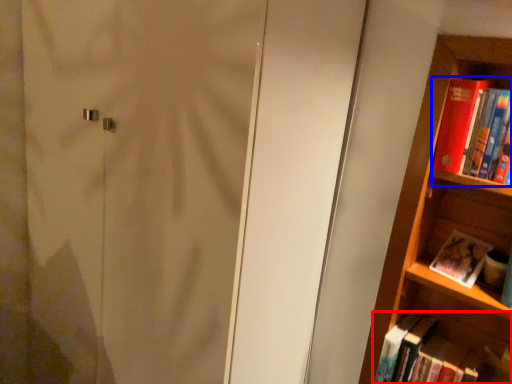
Question: Which of the following is the closest to the observer, book (highlighted by a red box) or book (highlighted by a blue box)?

Choices:
 (A) book
 (B) book

Answer: (B)